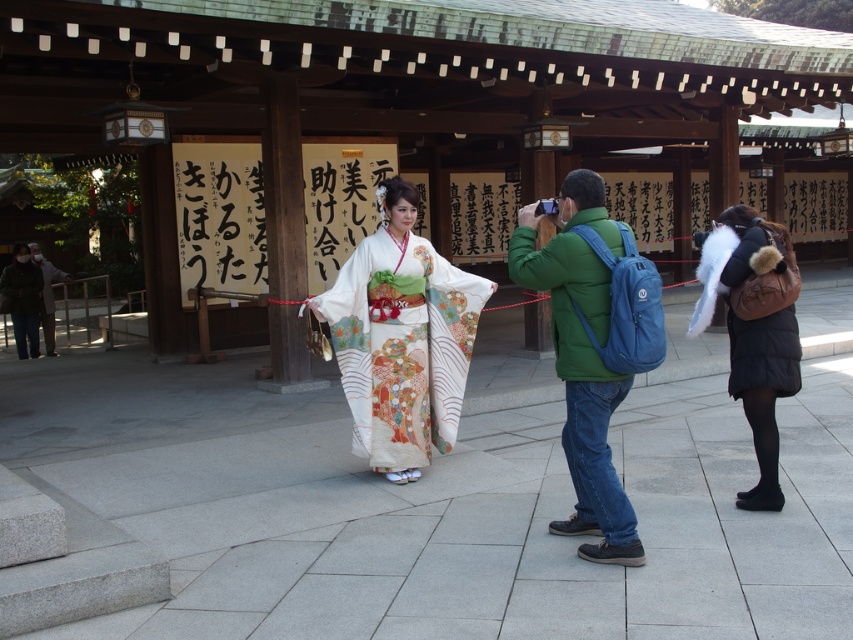
Question: In this image, where is brown fuzzy coat at lower right located relative to dark gray fabric jacket at left?

Choices:
 (A) left
 (B) right

Answer: (B)

Question: Considering the relative positions of green matte jacket at center and dark gray fabric jacket at left in the image provided, where is green matte jacket at center located with respect to dark gray fabric jacket at left?

Choices:
 (A) below
 (B) above

Answer: (A)

Question: Based on their relative distances, which object is farther from the green matte jacket at center?

Choices:
 (A) brown fuzzy coat at lower right
 (B) white silk kimono at center
 (C) dark gray fabric jacket at left

Answer: (C)

Question: Which is farther from the white silk kimono at center?

Choices:
 (A) green matte jacket at center
 (B) dark gray fabric jacket at left

Answer: (B)

Question: Which of the following is the closest to the observer?

Choices:
 (A) (41, 273)
 (B) (392, 480)

Answer: (B)

Question: Can you confirm if white silk kimono at center is positioned to the left of brown fuzzy coat at lower right?

Choices:
 (A) yes
 (B) no

Answer: (A)